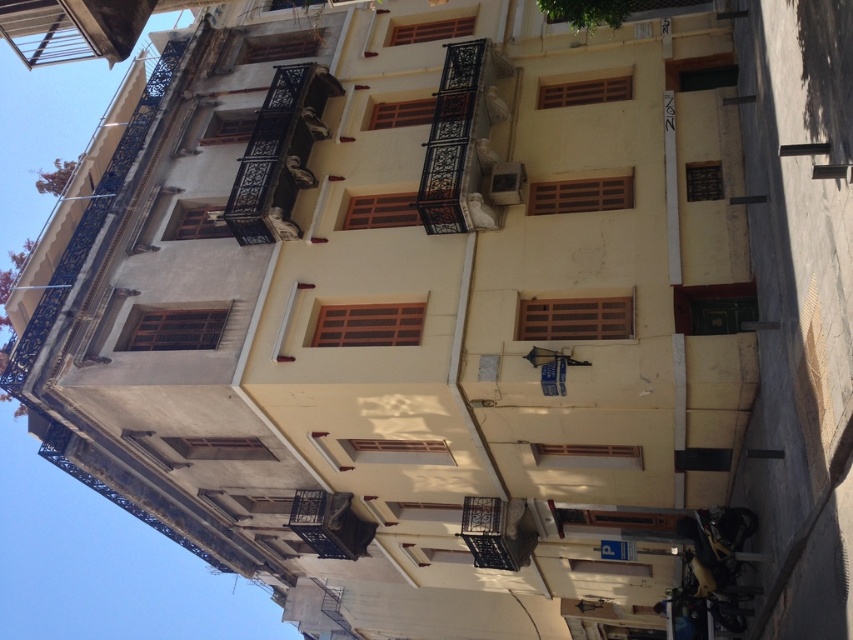
You are a delivery person trying to park your 1.2 meter wide cart between the smooth concrete sidewalk at lower right and the rustic wrought iron balcony at center. Can your cart fit in the space between them?

The smooth concrete sidewalk at lower right is wider than the rustic wrought iron balcony at center, so the 1.2 meter wide cart can fit between them as the space is wider than the cart.

You are standing on the smooth concrete sidewalk at lower right and want to look down at the black wrought iron balcony at center. Is the balcony below you?

Yes, the smooth concrete sidewalk at lower right is located above the black wrought iron balcony at center, so the balcony is indeed below you.